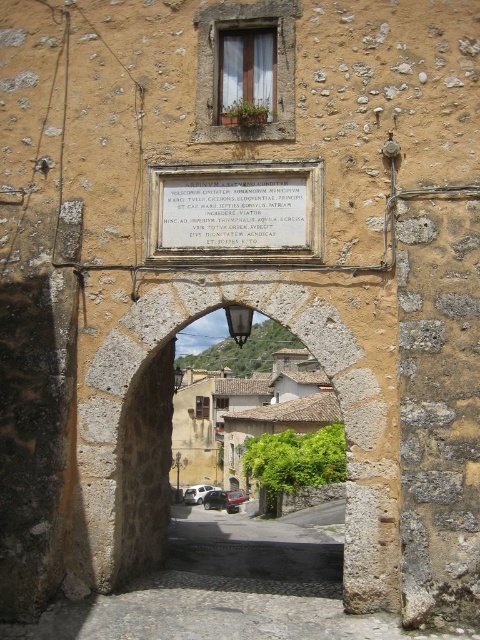
You are an architect examining the historic stone archway and its plaque. Given that the stone archway at center must be preserved, can the white stone plaque at center be replaced with a larger one without altering the archway at center?

The stone archway at center is bigger than the white stone plaque at center, so there is likely enough space to replace the plaque with a larger one without altering the archway at center.